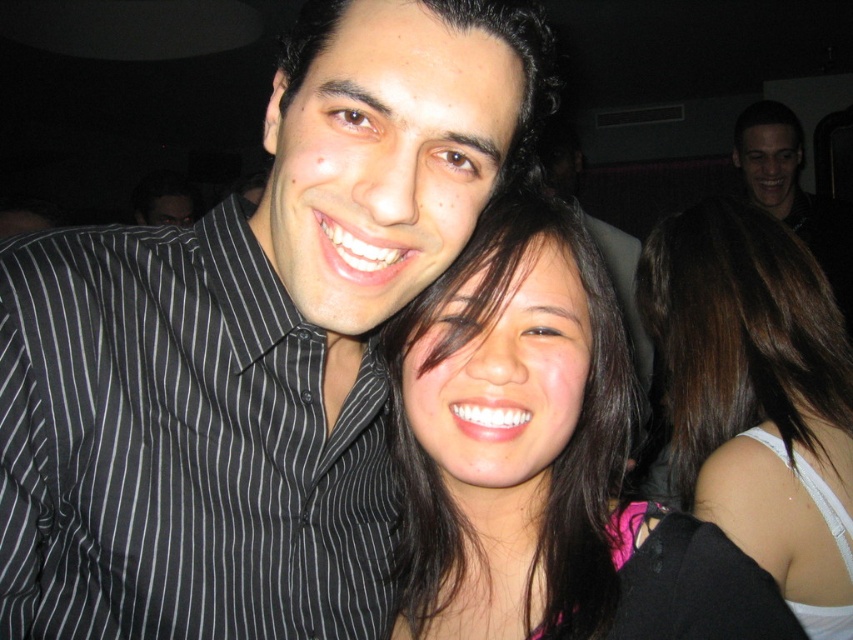
Between black striped shirt at center and smooth dark hair at center, which one appears on the right side from the viewer's perspective?

smooth dark hair at center

Who is more forward, (177, 278) or (416, 353)?

Positioned in front is point (416, 353).

You are a GUI agent. You are given a task and a screenshot of the screen. Output one action in this format:
    pyautogui.click(x=<x>, y=<y>)
    Task: Click on the black striped shirt at center
    
    Given the screenshot: What is the action you would take?
    pyautogui.click(x=251, y=348)

Where is `black striped shirt at center`? black striped shirt at center is located at coordinates (251, 348).

Who is lower down, black striped shirt at center or black matte shirt at upper right?

Positioned lower is black striped shirt at center.

Based on the photo, is black striped shirt at center bigger than black matte shirt at upper right?

Incorrect, black striped shirt at center is not larger than black matte shirt at upper right.

Which is in front, point (169, 468) or point (846, 218)?

Positioned in front is point (169, 468).

Locate an element on the screen. black striped shirt at center is located at coordinates (251, 348).

Who is higher up, smooth dark hair at center or dark brown hair at center?

Positioned higher is smooth dark hair at center.

Which is below, smooth dark hair at center or dark brown hair at center?

dark brown hair at center

Which is behind, point (492, 339) or point (776, 449)?

The point (776, 449) is more distant.

Where is `smooth dark hair at center`? smooth dark hair at center is located at coordinates (543, 460).